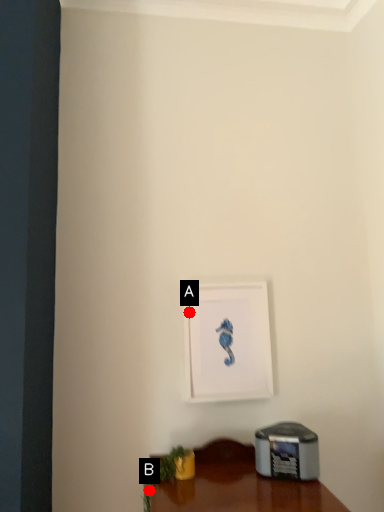
Question: Two points are circled on the image, labeled by A and B beside each circle. Among these points, which one is farthest from the camera?

Choices:
 (A) A is further
 (B) B is further

Answer: (A)